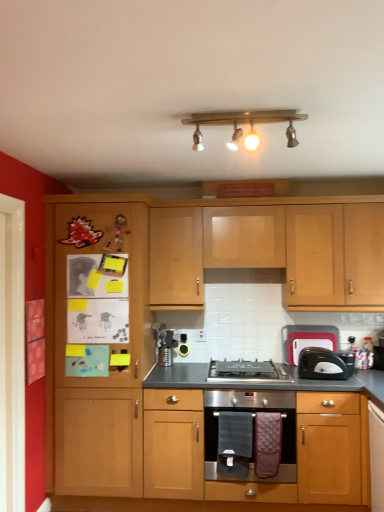
Question: Does point (119, 410) appear closer or farther from the camera than point (359, 456)?

Choices:
 (A) closer
 (B) farther

Answer: (B)

Question: Is wooden cabinet at left taller or shorter than matte wood oven at center, which is the 2th cabinetry in top-to-bottom order?

Choices:
 (A) short
 (B) tall

Answer: (B)

Question: Estimate the real-world distances between objects in this image. Which object is farther from the black plastic toaster at right?

Choices:
 (A) stainless steel oven at center
 (B) matte wood oven at center, which is the 2th cabinetry in top-to-bottom order
 (C) light wood cabinet at upper center, placed as the second cabinetry when sorted from bottom to top
 (D) wooden light fixture at upper center
 (E) white glossy door at left

Answer: (E)

Question: Which is nearer to the wooden light fixture at upper center?

Choices:
 (A) white glossy door at left
 (B) black plastic toaster at right
 (C) light wood cabinet at upper center, placed as the second cabinetry when sorted from bottom to top
 (D) wooden cabinet at left
 (E) black plastic toaster at right

Answer: (C)